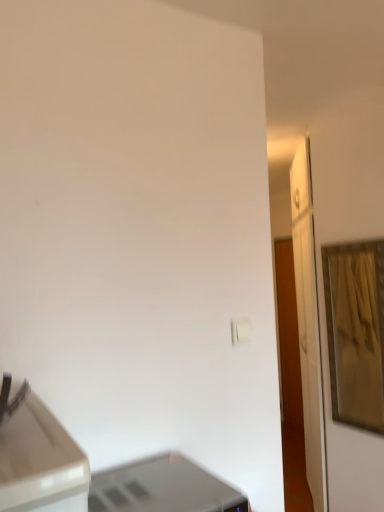
Question: Is gold metallic picture frame at right wider or thinner than satin silver printer at lower center?

Choices:
 (A) thin
 (B) wide

Answer: (A)

Question: In terms of height, does gold metallic picture frame at right look taller or shorter compared to satin silver printer at lower center?

Choices:
 (A) short
 (B) tall

Answer: (B)

Question: Which is correct: gold metallic picture frame at right is inside satin silver printer at lower center, or outside of it?

Choices:
 (A) inside
 (B) outside

Answer: (B)

Question: Considering the positions of satin silver printer at lower center and gold metallic picture frame at right in the image, is satin silver printer at lower center wider or thinner than gold metallic picture frame at right?

Choices:
 (A) thin
 (B) wide

Answer: (B)

Question: Is point (177, 460) positioned closer to the camera than point (347, 347)?

Choices:
 (A) farther
 (B) closer

Answer: (B)

Question: From their relative heights in the image, would you say satin silver printer at lower center is taller or shorter than gold metallic picture frame at right?

Choices:
 (A) short
 (B) tall

Answer: (A)

Question: Looking at the image, does satin silver printer at lower center seem bigger or smaller compared to gold metallic picture frame at right?

Choices:
 (A) small
 (B) big

Answer: (A)